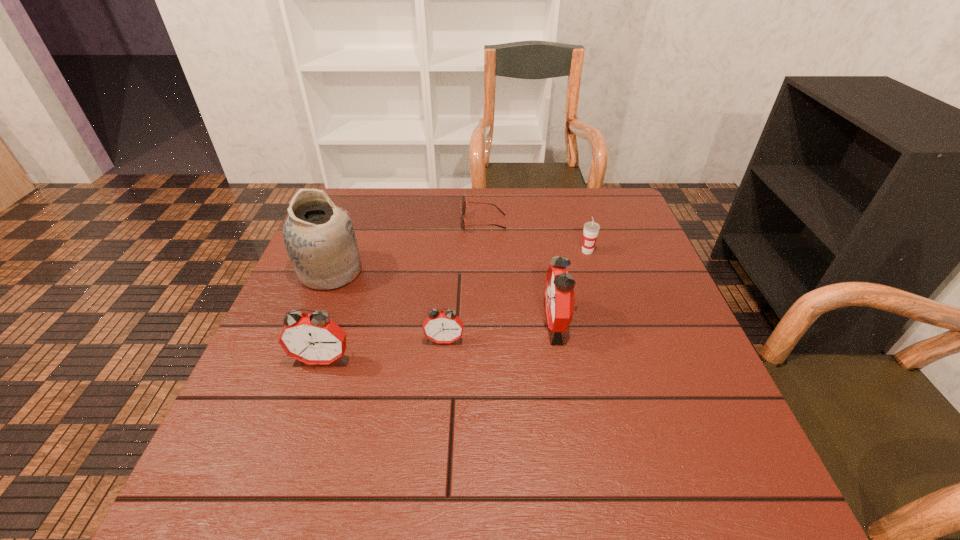
At what (x,y) coordinates should I click in order to perform the action: click on pottery present at the left edge. Please return your answer as a coordinate pair (x, y). This screenshot has width=960, height=540. Looking at the image, I should click on (319, 237).

The width and height of the screenshot is (960, 540). Identify the location of object at the right edge. (591, 229).

Identify the location of free spot at the far edge of the desktop. (483, 219).

Where is `free location at the near edge`? free location at the near edge is located at coordinates (438, 441).

You are a GUI agent. You are given a task and a screenshot of the screen. Output one action in this format:
    pyautogui.click(x=<x>, y=<y>)
    Task: Click on the vacant space at the left edge of the desktop
    
    Given the screenshot: What is the action you would take?
    pyautogui.click(x=252, y=380)

This screenshot has height=540, width=960. In order to click on free spot at the right edge of the desktop in this screenshot , I will do `click(672, 330)`.

I want to click on vacant space at the far left corner of the desktop, so click(358, 188).

This screenshot has width=960, height=540. I want to click on free space at the near left corner of the desktop, so pyautogui.click(x=267, y=419).

This screenshot has height=540, width=960. In order to click on vacant space at the far right corner in this screenshot , I will do `click(604, 194)`.

Identify the location of free spot between the farthest object and the leftmost alarm clock. (403, 291).